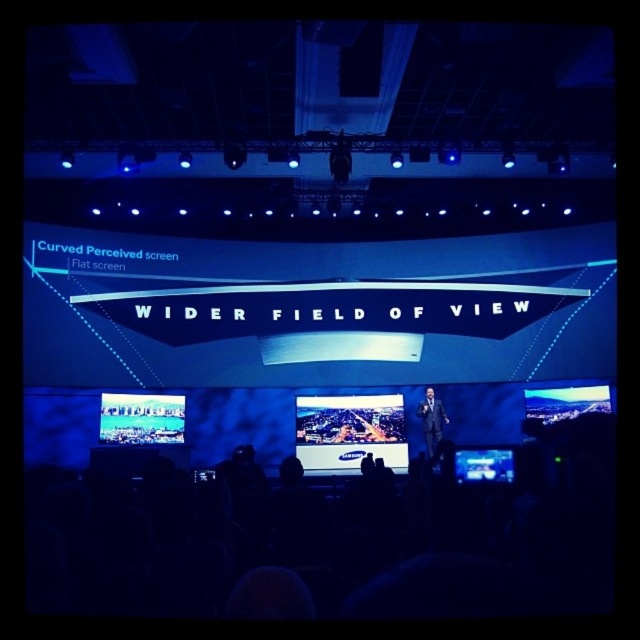
You are an attendee at the presentation and want to take a photo of both the matte black screen at center and the matte black screen at lower right. Which screen should you focus on first to ensure both are in frame without moving the camera?

You should focus on the matte black screen at center first because its width is larger than the matte black screen at lower right, so centering the larger screen will help keep both in frame.

You are an event organizer setting up a tech conference. You need to place two matte black screens, one at the center and one at the lower left, such that they are exactly 7 meters apart. Based on the scene provided, will the current placement of the matte black screen at center and the matte black screen at lower left meet this requirement?

The matte black screen at center and the matte black screen at lower left are 6.96 meters apart from each other, which is slightly less than the required 7 meters. Therefore, the current placement does not meet the requirement.

You are an attendee at the presentation. The presenter is standing to your right. The screen is located at the center of the stage. If you want to focus on the presenter while still keeping the matte black screen at center in your peripheral vision, which direction should you turn your head?

You should turn your head to your left to keep the matte black screen at center in your peripheral vision while focusing on the presenter to your right.